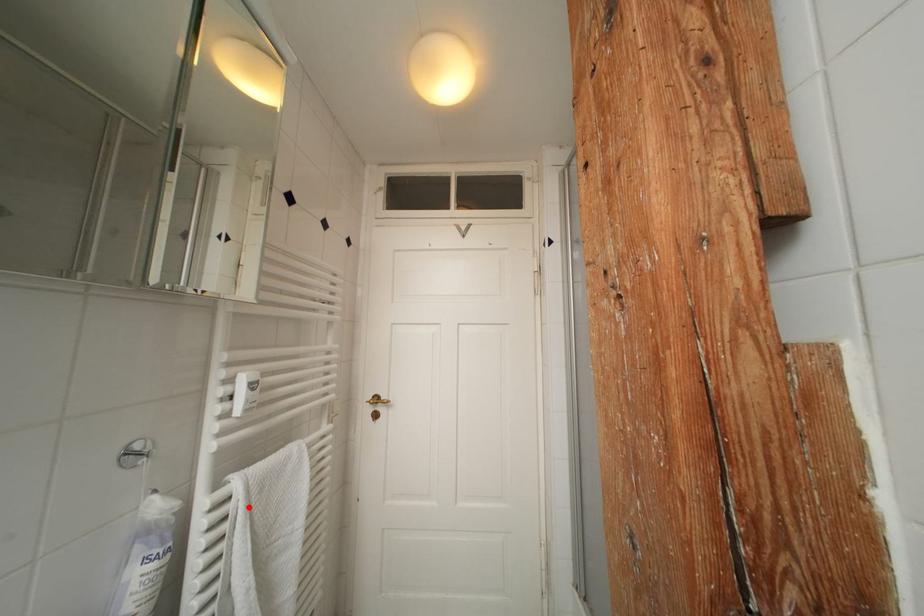
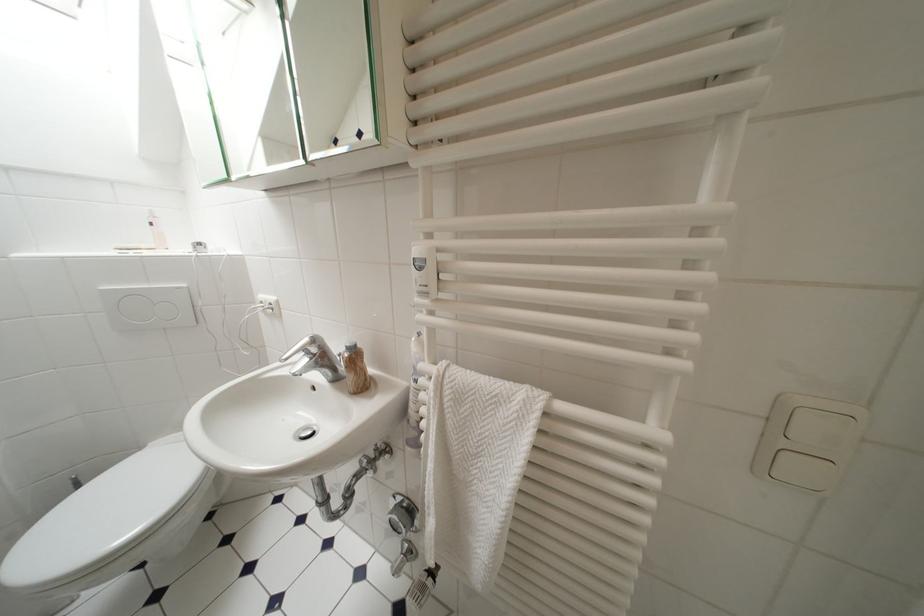
In the second image, find the point that corresponds to the highlighted location in the first image.

(439, 397)